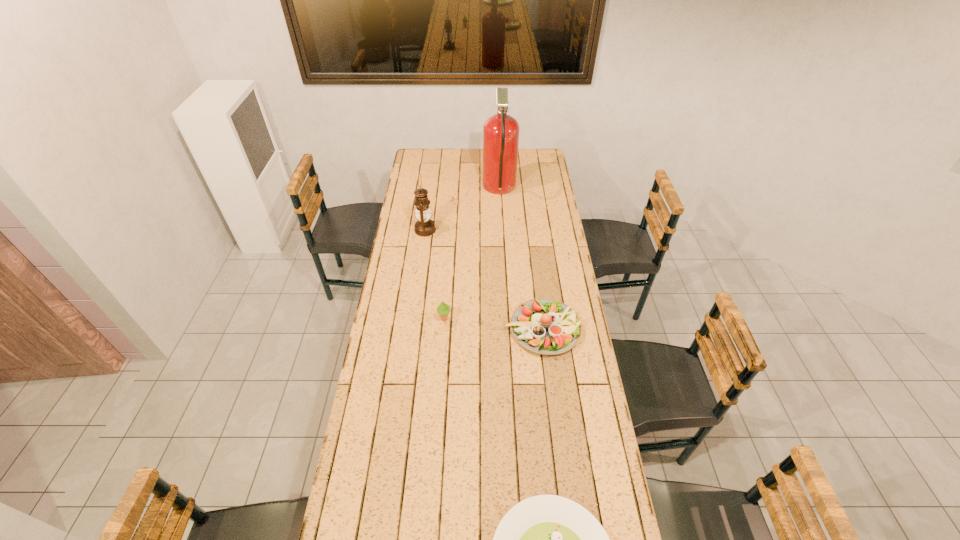
Locate an element on the screen. The height and width of the screenshot is (540, 960). empty location between the fire extinguisher and the fourth tallest object is located at coordinates (521, 259).

Find the location of `vacant area that lies between the farthest object and the farther salad plate`. vacant area that lies between the farthest object and the farther salad plate is located at coordinates 521,259.

Identify which object is located as the fourth nearest to the second tallest object. Please provide its 2D coordinates. Your answer should be formatted as a tuple, i.e. [(x, y)], where the tuple contains the x and y coordinates of a point satisfying the conditions above.

[(546, 539)]

I want to click on object that is the closest one to the taller salad plate, so click(x=443, y=309).

Find the location of a particular element. free location that satisfies the following two spatial constraints: 1. with the handle and nozzle on the tallest object; 2. on the left side of the taller salad plate is located at coordinates (507, 329).

Where is `blank area in the image that satisfies the following two spatial constraints: 1. on the front side of the second object from left to right; 2. on the right side of the farther salad plate`? blank area in the image that satisfies the following two spatial constraints: 1. on the front side of the second object from left to right; 2. on the right side of the farther salad plate is located at coordinates (444, 329).

This screenshot has width=960, height=540. I want to click on free location that satisfies the following two spatial constraints: 1. with the handle and nozzle on the tallest object; 2. on the front side of the second tallest object, so click(502, 230).

Where is `vacant position in the image that satisfies the following two spatial constraints: 1. on the front side of the second object from left to right; 2. on the right side of the leftmost object`? Image resolution: width=960 pixels, height=540 pixels. vacant position in the image that satisfies the following two spatial constraints: 1. on the front side of the second object from left to right; 2. on the right side of the leftmost object is located at coordinates (413, 319).

This screenshot has height=540, width=960. What are the coordinates of `free location that satisfies the following two spatial constraints: 1. with the handle and nozzle on the fourth tallest object; 2. on the left side of the tallest object` in the screenshot? It's located at (507, 329).

Where is `vacant region that satisfies the following two spatial constraints: 1. on the front side of the icecream; 2. on the left side of the farther salad plate`? This screenshot has height=540, width=960. vacant region that satisfies the following two spatial constraints: 1. on the front side of the icecream; 2. on the left side of the farther salad plate is located at coordinates (444, 329).